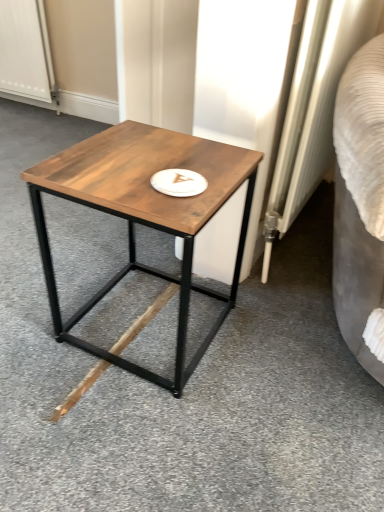
At what (x,y) coordinates should I click in order to perform the action: click on vacant space in front of white matte platter at center. Please return your answer as a coordinate pair (x, y). This screenshot has height=512, width=384. Looking at the image, I should click on (170, 208).